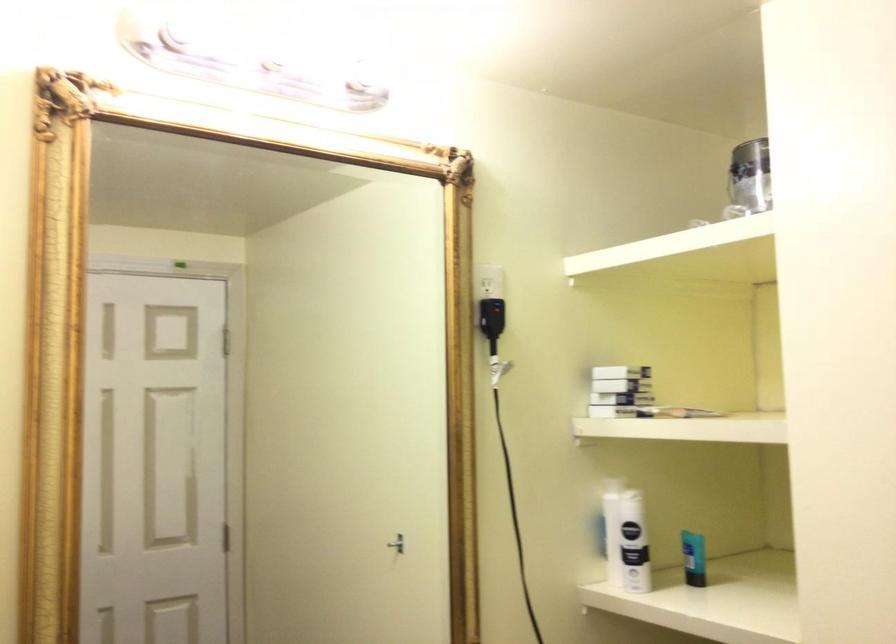
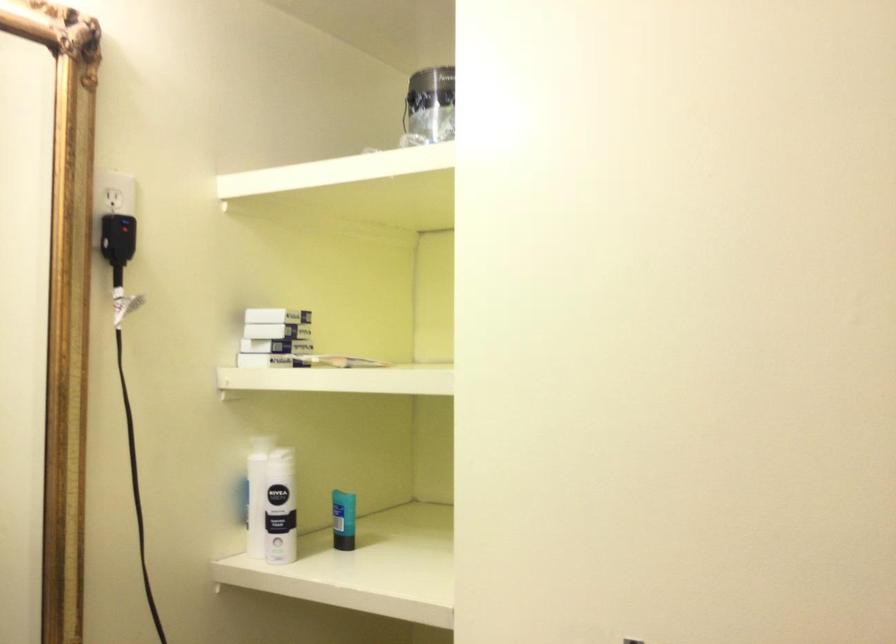
The point at (764, 175) is marked in the first image. Where is the corresponding point in the second image?

(428, 106)